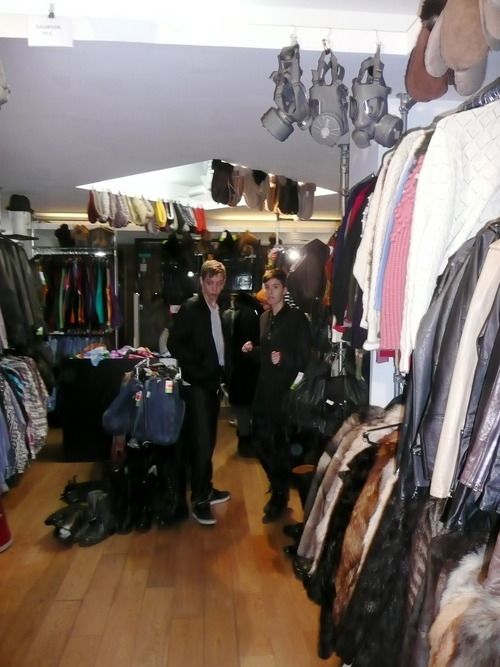
Where is `light source/above light`? The height and width of the screenshot is (667, 500). light source/above light is located at coordinates (163, 181).